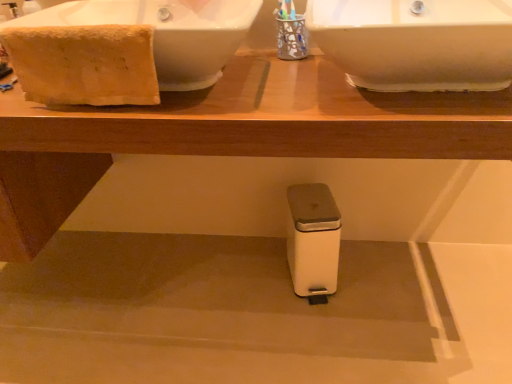
In the scene shown: Measure the distance between white plastic table at center and camera.

white plastic table at center is 30.63 inches away from camera.

What do you see at coordinates (166, 33) in the screenshot? The height and width of the screenshot is (384, 512). I see `white glossy sink at upper left, which is counted as the first sink, starting from the left` at bounding box center [166, 33].

The height and width of the screenshot is (384, 512). What are the coordinates of `beige cotton towel at upper left` in the screenshot? It's located at (84, 64).

Describe the element at coordinates (416, 43) in the screenshot. I see `white glossy sink at upper right, the 2th sink from the left` at that location.

At what (x,y) coordinates should I click in order to perform the action: click on white plastic table at center. Please return your answer as a coordinate pair (x, y). Image resolution: width=512 pixels, height=384 pixels. Looking at the image, I should click on (229, 134).

Is point (49, 20) closer to viewer compared to point (48, 65)?

That is False.

Which is more to the left, white glossy sink at upper left, which is counted as the first sink, starting from the left, or beige cotton towel at upper left?

beige cotton towel at upper left is more to the left.

Between white glossy sink at upper left, which is counted as the first sink, starting from the left, and beige cotton towel at upper left, which one has larger size?

white glossy sink at upper left, which is counted as the first sink, starting from the left.

Which object is more forward, white glossy sink at upper left, which ranks as the 2th sink in right-to-left order, or beige cotton towel at upper left?

white glossy sink at upper left, which ranks as the 2th sink in right-to-left order, is more forward.

Is white glossy sink at upper left, which is counted as the first sink, starting from the left, shorter than white plastic table at center?

Yes.

Between white glossy sink at upper left, which ranks as the 2th sink in right-to-left order, and white plastic table at center, which one has larger width?

white plastic table at center is wider.

Measure the distance from white glossy sink at upper left, which is counted as the first sink, starting from the left, to white plastic table at center.

white glossy sink at upper left, which is counted as the first sink, starting from the left, is 10.18 inches from white plastic table at center.

Is there a large distance between white glossy sink at upper left, which is counted as the first sink, starting from the left, and white plastic table at center?

No.

How different are the orientations of white plastic table at center and beige cotton towel at upper left in degrees?

0.0026 degrees.

Is white plastic table at center far from beige cotton towel at upper left?

No, there isn't a large distance between white plastic table at center and beige cotton towel at upper left.

Identify the location of material above the white plastic table at center (from the image's perspective). (84, 64).

Is white plastic table at center inside the boundaries of beige cotton towel at upper left, or outside?

white plastic table at center cannot be found inside beige cotton towel at upper left.

Which of these two, white plastic table at center or white glossy sink at upper right, acting as the first sink starting from the right, stands shorter?

white glossy sink at upper right, acting as the first sink starting from the right.

Identify the location of the 1st sink behind the white plastic table at center. (416, 43).

Does white plastic table at center have a greater width compared to white glossy sink at upper right, the 2th sink from the left?

Yes, white plastic table at center is wider than white glossy sink at upper right, the 2th sink from the left.

Between white plastic table at center and white glossy sink at upper right, acting as the first sink starting from the right, which one is positioned behind?

white glossy sink at upper right, acting as the first sink starting from the right, is further from the camera.

Do you think beige cotton towel at upper left is within white glossy sink at upper left, which is counted as the first sink, starting from the left, or outside of it?

beige cotton towel at upper left exists entirely within white glossy sink at upper left, which is counted as the first sink, starting from the left.

Considering the points (20, 74) and (187, 71), which point is behind, point (20, 74) or point (187, 71)?

The point (187, 71) is farther from the camera.

From the image's perspective, is beige cotton towel at upper left positioned above or below white glossy sink at upper left, which is counted as the first sink, starting from the left?

Based on their image positions, beige cotton towel at upper left is located beneath white glossy sink at upper left, which is counted as the first sink, starting from the left.

From a real-world perspective, is beige cotton towel at upper left on top of white glossy sink at upper left, which ranks as the 2th sink in right-to-left order?

Indeed, from a real-world perspective, beige cotton towel at upper left stands above white glossy sink at upper left, which ranks as the 2th sink in right-to-left order.

Based on the photo, is beige cotton towel at upper left far away from white glossy sink at upper right, the 2th sink from the left?

No.

Considering the sizes of beige cotton towel at upper left and white glossy sink at upper right, acting as the first sink starting from the right, in the image, is beige cotton towel at upper left taller or shorter than white glossy sink at upper right, acting as the first sink starting from the right,?

In the image, beige cotton towel at upper left appears to be taller than white glossy sink at upper right, acting as the first sink starting from the right.

From the image's perspective, is beige cotton towel at upper left on top of white glossy sink at upper right, the 2th sink from the left?

No, from the image's perspective, beige cotton towel at upper left is not on top of white glossy sink at upper right, the 2th sink from the left.

Considering the points (66, 90) and (505, 43), which point is in front, point (66, 90) or point (505, 43)?

Point (505, 43)

Is beige cotton towel at upper left inside white glossy sink at upper right, the 2th sink from the left?

Definitely not — beige cotton towel at upper left is not inside white glossy sink at upper right, the 2th sink from the left.

From a real-world perspective, is white glossy sink at upper right, the 2th sink from the left, above or below beige cotton towel at upper left?

In terms of real-world spatial position, white glossy sink at upper right, the 2th sink from the left, is below beige cotton towel at upper left.

Considering the relative sizes of white glossy sink at upper right, the 2th sink from the left, and beige cotton towel at upper left in the image provided, is white glossy sink at upper right, the 2th sink from the left, bigger than beige cotton towel at upper left?

Yes, white glossy sink at upper right, the 2th sink from the left, is bigger than beige cotton towel at upper left.

Does white glossy sink at upper right, acting as the first sink starting from the right, have a greater width compared to beige cotton towel at upper left?

Yes, white glossy sink at upper right, acting as the first sink starting from the right, is wider than beige cotton towel at upper left.

This screenshot has height=384, width=512. In order to click on material below the white glossy sink at upper left, which ranks as the 2th sink in right-to-left order (from the image's perspective) in this screenshot , I will do `click(84, 64)`.

Identify the location of table below the white glossy sink at upper left, which is counted as the first sink, starting from the left (from a real-world perspective). (229, 134).

Looking at the image, which one is located further to white glossy sink at upper right, acting as the first sink starting from the right, white plastic table at center or white glossy sink at upper left, which ranks as the 2th sink in right-to-left order?

white glossy sink at upper left, which ranks as the 2th sink in right-to-left order, is further to white glossy sink at upper right, acting as the first sink starting from the right.

Considering their positions, is white glossy sink at upper left, which is counted as the first sink, starting from the left, positioned further to white glossy sink at upper right, acting as the first sink starting from the right, than white plastic table at center?

white glossy sink at upper left, which is counted as the first sink, starting from the left, lies further to white glossy sink at upper right, acting as the first sink starting from the right, than the other object.

Estimate the real-world distances between objects in this image. Which object is further from white glossy sink at upper left, which is counted as the first sink, starting from the left, white plastic table at center or beige cotton towel at upper left?

Among the two, white plastic table at center is located further to white glossy sink at upper left, which is counted as the first sink, starting from the left.

Estimate the real-world distances between objects in this image. Which object is further from white glossy sink at upper left, which is counted as the first sink, starting from the left, white glossy sink at upper right, acting as the first sink starting from the right, or beige cotton towel at upper left?

Among the two, white glossy sink at upper right, acting as the first sink starting from the right, is located further to white glossy sink at upper left, which is counted as the first sink, starting from the left.

From the picture: When comparing their distances from white plastic table at center, does white glossy sink at upper left, which ranks as the 2th sink in right-to-left order, or beige cotton towel at upper left seem further?

white glossy sink at upper left, which ranks as the 2th sink in right-to-left order, is positioned further to the anchor white plastic table at center.

When comparing their distances from white plastic table at center, does white glossy sink at upper right, acting as the first sink starting from the right, or white glossy sink at upper left, which is counted as the first sink, starting from the left, seem closer?

Among the two, white glossy sink at upper left, which is counted as the first sink, starting from the left, is located nearer to white plastic table at center.

Estimate the real-world distances between objects in this image. Which object is closer to beige cotton towel at upper left, white glossy sink at upper right, the 2th sink from the left, or white glossy sink at upper left, which ranks as the 2th sink in right-to-left order?

white glossy sink at upper left, which ranks as the 2th sink in right-to-left order, is closer to beige cotton towel at upper left.

When comparing their distances from white glossy sink at upper left, which ranks as the 2th sink in right-to-left order, does beige cotton towel at upper left or white glossy sink at upper right, the 2th sink from the left, seem further?

white glossy sink at upper right, the 2th sink from the left, is positioned further to the anchor white glossy sink at upper left, which ranks as the 2th sink in right-to-left order.

Find the location of `material between white glossy sink at upper left, which is counted as the first sink, starting from the left, and white plastic table at center from top to bottom`. material between white glossy sink at upper left, which is counted as the first sink, starting from the left, and white plastic table at center from top to bottom is located at coordinates (84, 64).

Where is `table between beige cotton towel at upper left and white glossy sink at upper right, the 2th sink from the left, in the horizontal direction`? table between beige cotton towel at upper left and white glossy sink at upper right, the 2th sink from the left, in the horizontal direction is located at coordinates (229, 134).

Identify the location of sink situated between beige cotton towel at upper left and white glossy sink at upper right, the 2th sink from the left, from left to right. This screenshot has width=512, height=384. (166, 33).

The image size is (512, 384). What are the coordinates of `table located between white glossy sink at upper left, which is counted as the first sink, starting from the left, and white glossy sink at upper right, acting as the first sink starting from the right, in the left-right direction` in the screenshot? It's located at (229, 134).